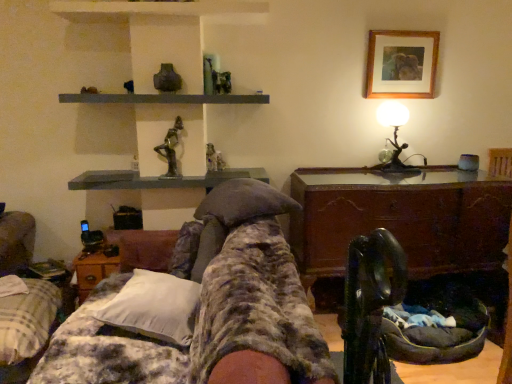
Question: Considering the relative sizes of matte gray figurine at center and plaid fabric bedspread at lower left, acting as the first furniture starting from the left, in the image provided, is matte gray figurine at center bigger than plaid fabric bedspread at lower left, acting as the first furniture starting from the left,?

Choices:
 (A) yes
 (B) no

Answer: (B)

Question: Is matte gray figurine at center wider than plaid fabric bedspread at lower left, acting as the first furniture starting from the left?

Choices:
 (A) no
 (B) yes

Answer: (A)

Question: Is matte gray figurine at center next to plaid fabric bedspread at lower left, the second furniture positioned from the right?

Choices:
 (A) yes
 (B) no

Answer: (B)

Question: From a real-world perspective, is matte gray figurine at center located higher than plaid fabric bedspread at lower left, acting as the first furniture starting from the left?

Choices:
 (A) yes
 (B) no

Answer: (A)

Question: Is matte gray figurine at center thinner than plaid fabric bedspread at lower left, acting as the first furniture starting from the left?

Choices:
 (A) no
 (B) yes

Answer: (B)

Question: In terms of height, does bronze statue at upper center look taller or shorter compared to fluffy fabric blanket at center, arranged as the 1th furniture when viewed from the right?

Choices:
 (A) tall
 (B) short

Answer: (B)

Question: Looking at their shapes, would you say bronze statue at upper center is wider or thinner than fluffy fabric blanket at center, marked as the second furniture in a left-to-right arrangement?

Choices:
 (A) thin
 (B) wide

Answer: (A)

Question: Considering their positions, is bronze statue at upper center located in front of or behind fluffy fabric blanket at center, marked as the second furniture in a left-to-right arrangement?

Choices:
 (A) behind
 (B) front

Answer: (A)

Question: Does point (174, 135) appear closer or farther from the camera than point (105, 329)?

Choices:
 (A) farther
 (B) closer

Answer: (A)

Question: Considering the positions of wooden chest at center, the 2th table when ordered from left to right, and woodenmaterial/texturetable at lower left, acting as the 1th table starting from the left, in the image, is wooden chest at center, the 2th table when ordered from left to right, taller or shorter than woodenmaterial/texturetable at lower left, acting as the 1th table starting from the left,?

Choices:
 (A) short
 (B) tall

Answer: (B)

Question: From the image's perspective, is wooden chest at center, the 2th table when ordered from left to right, located above or below woodenmaterial/texturetable at lower left, the 2th table positioned from the right?

Choices:
 (A) above
 (B) below

Answer: (A)

Question: Considering their positions, is wooden chest at center, placed as the 1th table when sorted from right to left, located in front of or behind woodenmaterial/texturetable at lower left, the 2th table positioned from the right?

Choices:
 (A) behind
 (B) front

Answer: (B)

Question: Based on their positions, is wooden chest at center, placed as the 1th table when sorted from right to left, located to the left or right of woodenmaterial/texturetable at lower left, the 2th table positioned from the right?

Choices:
 (A) right
 (B) left

Answer: (A)

Question: Choose the correct answer: Is matte gray figurine at center inside white soft pillow at center or outside it?

Choices:
 (A) outside
 (B) inside

Answer: (A)

Question: Based on their sizes in the image, would you say matte gray figurine at center is bigger or smaller than white soft pillow at center?

Choices:
 (A) big
 (B) small

Answer: (B)